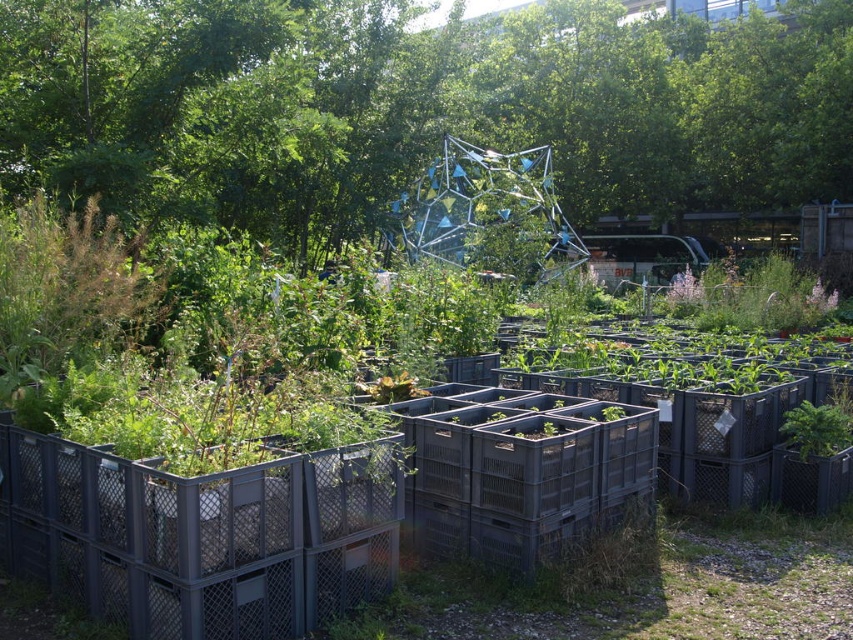
Is point (154, 19) less distant than point (54, 372)?

No, (154, 19) is behind (54, 372).

Does point (318, 189) come in front of point (693, 419)?

No, it is behind (693, 419).

I want to click on green leafy tree at center, so click(x=415, y=106).